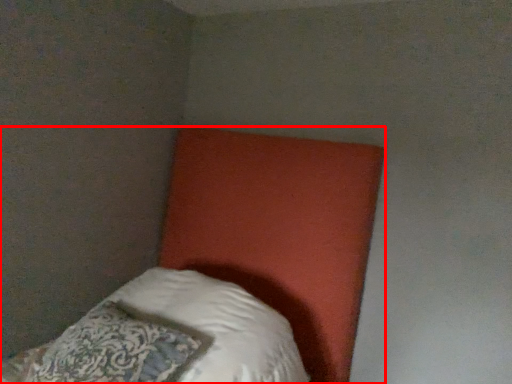
Question: Where is bed (annotated by the red box) located in relation to pillow in the image?

Choices:
 (A) right
 (B) left

Answer: (A)